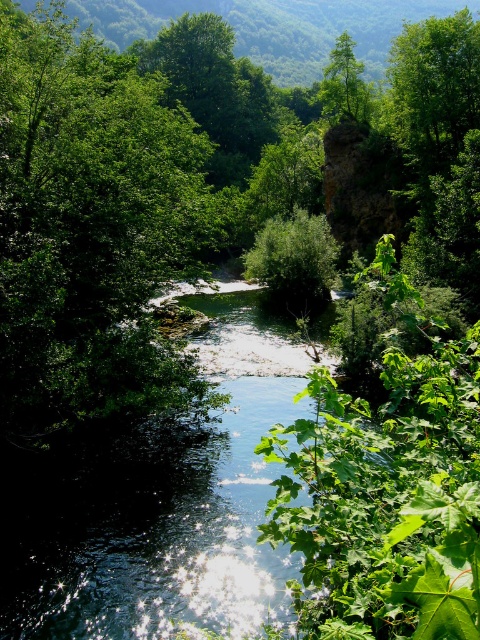
Question: Is the position of clear water at center more distant than that of green leafy tree at upper center?

Choices:
 (A) no
 (B) yes

Answer: (A)

Question: Which point appears farthest from the camera in this image?

Choices:
 (A) (224, 576)
 (B) (336, 58)

Answer: (B)

Question: Is clear water at center bigger than green leafy tree at upper center?

Choices:
 (A) no
 (B) yes

Answer: (A)

Question: Which of the following is the farthest from the observer?

Choices:
 (A) (331, 60)
 (B) (3, 568)

Answer: (A)

Question: Considering the relative positions of clear water at center and green leafy tree at upper center in the image provided, where is clear water at center located with respect to green leafy tree at upper center?

Choices:
 (A) below
 (B) above

Answer: (A)